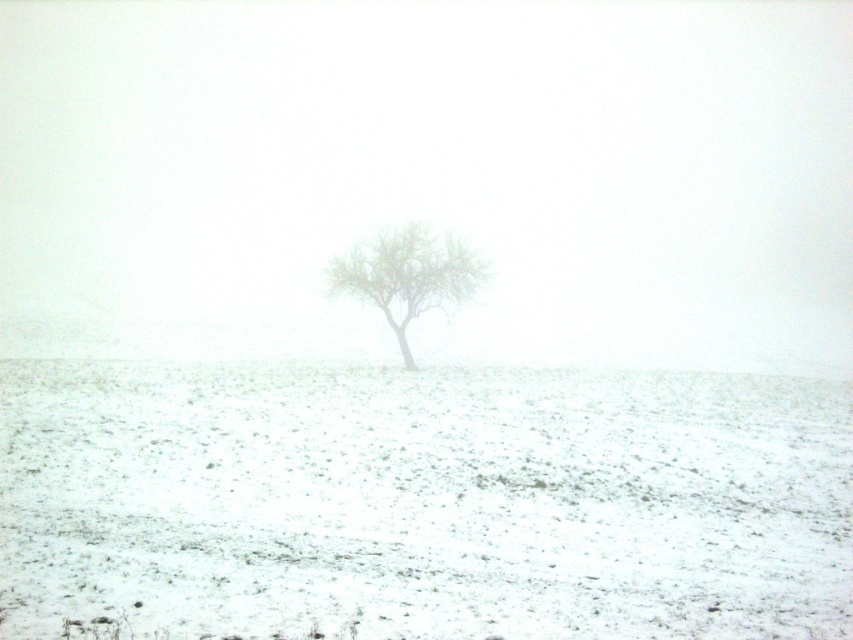
Based on the photo, you are standing at the point with coordinates point (402, 321) and want to walk towards the tree in the winter landscape. Will you pass through the point with coordinates point (563, 550) along your path?

Yes, because point (563, 550) is in front of point (402, 321), so walking towards the tree would require passing through it.

You are an environmental scientist studying the impact of snow cover on vegetation. You observe the white snow at center and the green leafy tree at center in the image. Which object occupies a larger area in the scene?

The white snow at center might be wider than green leafy tree at center, so it likely occupies a larger area in the scene.

You are an observer standing in the winter landscape. You notice the white snow at center and the green leafy tree at center. Which object is positioned closer to you?

The white snow at center is closer to the viewer than the green leafy tree at center.